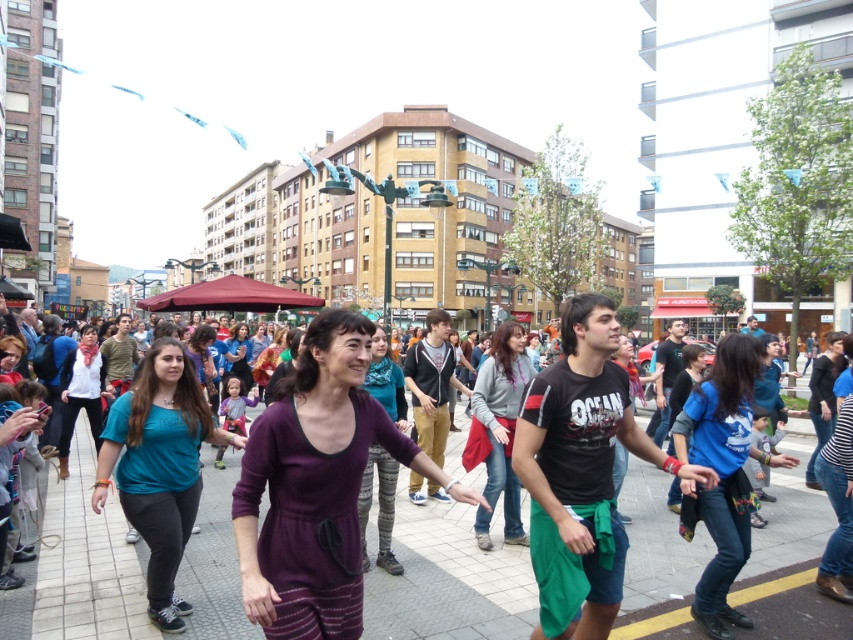
Is the position of blue denim jeans at center more distant than that of dark blue jeans at center?

No.

Who is positioned more to the left, blue denim jeans at center or dark blue jeans at center?

From the viewer's perspective, blue denim jeans at center appears more on the left side.

Which is in front, point (683, 404) or point (822, 392)?

Positioned in front is point (683, 404).

This screenshot has height=640, width=853. What are the coordinates of `blue denim jeans at center` in the screenshot? It's located at (722, 472).

Can you confirm if purple matte dress at center is thinner than teal fabric shirt at center?

Incorrect, purple matte dress at center's width is not less than teal fabric shirt at center's.

Is purple matte dress at center to the left of teal fabric shirt at center from the viewer's perspective?

Incorrect, purple matte dress at center is not on the left side of teal fabric shirt at center.

Between point (286, 630) and point (128, 451), which one is positioned in front?

Point (286, 630) is in front.

Image resolution: width=853 pixels, height=640 pixels. Find the location of `purple matte dress at center`. purple matte dress at center is located at coordinates (316, 486).

Is purple fabric crowd at center positioned behind purple knitwear at center?

No, purple fabric crowd at center is in front of purple knitwear at center.

Is purple fabric crowd at center closer to camera compared to purple knitwear at center?

Yes, it is.

Where is `purple fabric crowd at center`? Image resolution: width=853 pixels, height=640 pixels. purple fabric crowd at center is located at coordinates (123, 564).